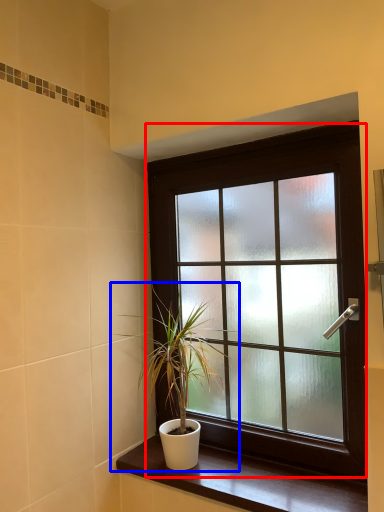
Question: Which object is further to the camera taking this photo, window (highlighted by a red box) or houseplant (highlighted by a blue box)?

Choices:
 (A) window
 (B) houseplant

Answer: (B)